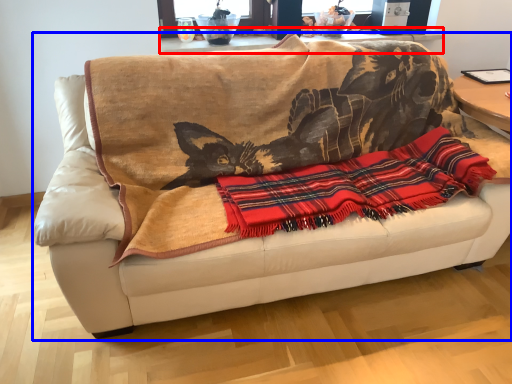
Question: Which object is closer to the camera taking this photo, table (highlighted by a red box) or studio couch (highlighted by a blue box)?

Choices:
 (A) table
 (B) studio couch

Answer: (B)